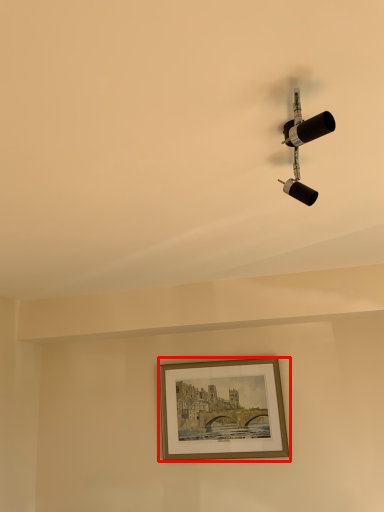
Question: In this image, where is picture frame (annotated by the red box) located relative to lamp?

Choices:
 (A) right
 (B) left

Answer: (B)